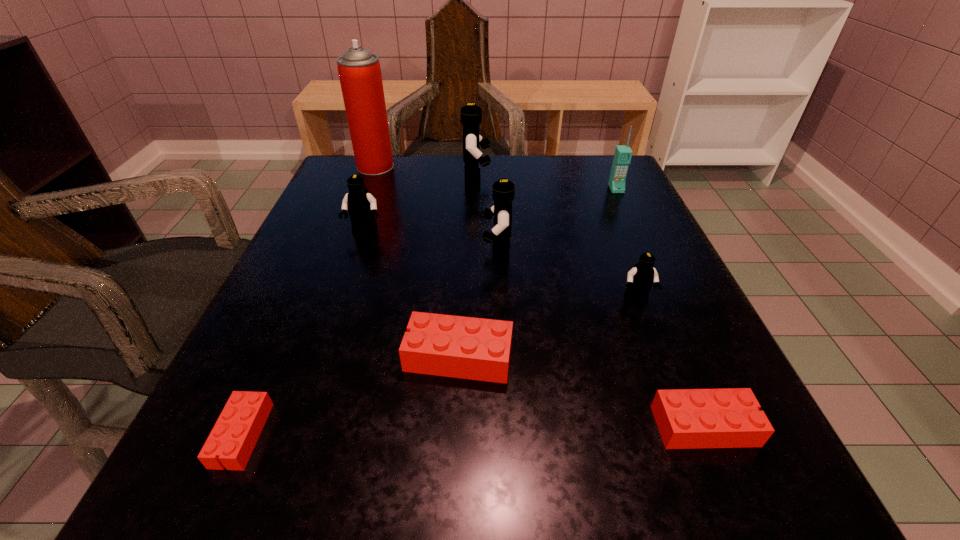
Where is `blank area at the far left corner`? The height and width of the screenshot is (540, 960). blank area at the far left corner is located at coordinates (388, 174).

Identify the location of vacant space at the far right corner of the desktop. (603, 204).

Identify the location of vacant space at the near right corner of the desktop. (725, 516).

I want to click on vacant region between the second biggest red Lego and the aerosol can, so click(540, 296).

Locate an element on the screen. The image size is (960, 540). vacant space in between the smallest red Lego and the fifth farthest Lego is located at coordinates (350, 396).

Locate an element on the screen. The height and width of the screenshot is (540, 960). unoccupied area between the sixth farthest object and the fifth tallest Lego is located at coordinates (548, 328).

Image resolution: width=960 pixels, height=540 pixels. I want to click on free space between the sixth tallest Lego and the farthest red Lego, so click(582, 392).

Locate an element on the screen. This screenshot has height=540, width=960. vacant space that's between the second biggest black Lego and the second red Lego from right to left is located at coordinates (478, 303).

This screenshot has height=540, width=960. Find the location of `free space that is in between the second smallest red Lego and the shortest Lego`. free space that is in between the second smallest red Lego and the shortest Lego is located at coordinates (473, 430).

I want to click on free spot between the shortest Lego and the fifth shortest object, so click(x=303, y=333).